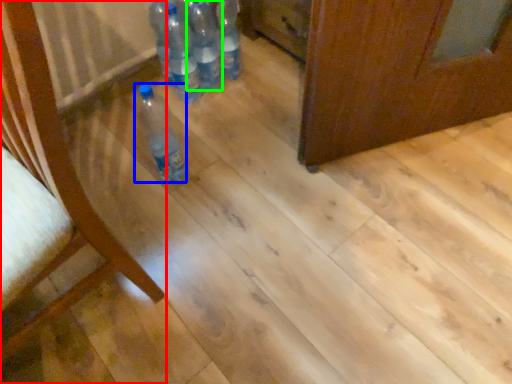
Question: Based on their relative distances, which object is nearer to furniture (highlighted by a red box)? Choose from bottle (highlighted by a blue box) and bottle (highlighted by a green box).

Choices:
 (A) bottle
 (B) bottle

Answer: (A)